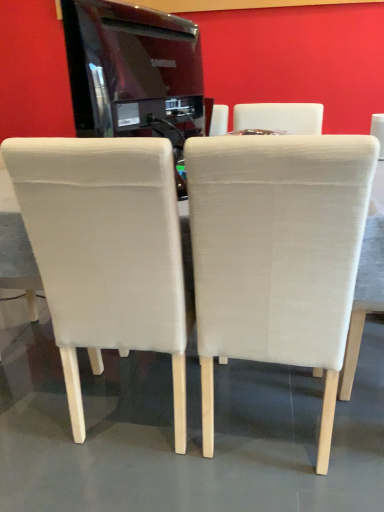
Question: From a real-world perspective, relative to beige fabric chair at center, positioned as the second chair in right-to-left order, is beige fabric chair at right, the third chair from the left, vertically above or below?

Choices:
 (A) below
 (B) above

Answer: (B)

Question: Is beige fabric chair at right, the third chair from the left, bigger or smaller than beige fabric chair at center, positioned as the second chair in right-to-left order?

Choices:
 (A) small
 (B) big

Answer: (A)

Question: Which object is positioned closest to the glossy black tv at upper center?

Choices:
 (A) beige fabric chair at center, the 3th chair in the right-to-left sequence
 (B) beige fabric chair at right, acting as the 1th chair starting from the right
 (C) beige fabric chair at center, positioned as the second chair in right-to-left order
 (D) white fabric table at center

Answer: (A)

Question: Estimate the real-world distances between objects in this image. Which object is closer to the beige fabric chair at center, positioned as the second chair in right-to-left order?

Choices:
 (A) glossy black tv at upper center
 (B) white fabric table at center
 (C) beige fabric chair at right, the third chair from the left
 (D) beige fabric chair at center, the 3th chair in the right-to-left sequence

Answer: (D)